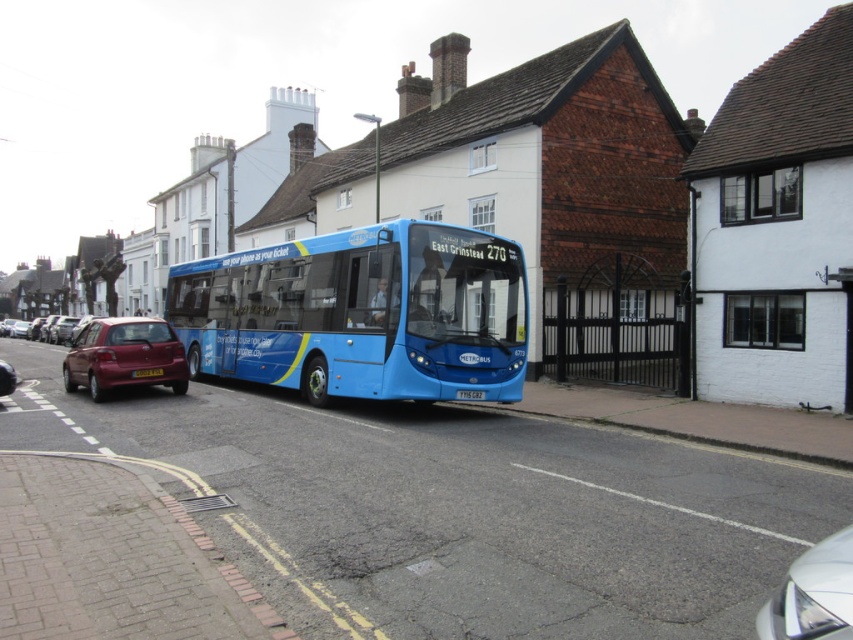
Question: Can you confirm if metallic red hatchback at lower left is thinner than yellow metallic license plate at center?

Choices:
 (A) no
 (B) yes

Answer: (A)

Question: Is metallic red car at left closer to camera compared to yellow metallic license plate at center?

Choices:
 (A) no
 (B) yes

Answer: (A)

Question: Can you confirm if black metal gate at center is bigger than metallic red hatchback at lower left?

Choices:
 (A) no
 (B) yes

Answer: (A)

Question: Based on their relative distances, which object is nearer to the silver metallic car at lower right?

Choices:
 (A) metallic red car at left
 (B) blue metallic bus at center
 (C) yellow metallic license plate at center
 (D) metallic red hatchback at lower left

Answer: (C)

Question: Which point is farther from the camera taking this photo?

Choices:
 (A) (791, 563)
 (B) (485, 392)
 (C) (1, 381)
 (D) (682, 372)

Answer: (D)

Question: Which point is farther from the camera taking this photo?

Choices:
 (A) (471, 336)
 (B) (138, 372)

Answer: (B)